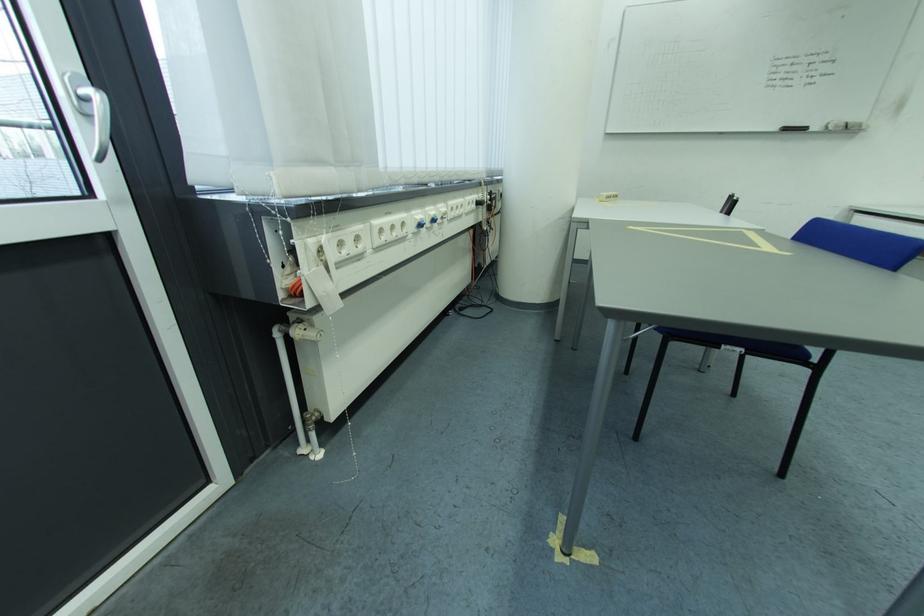
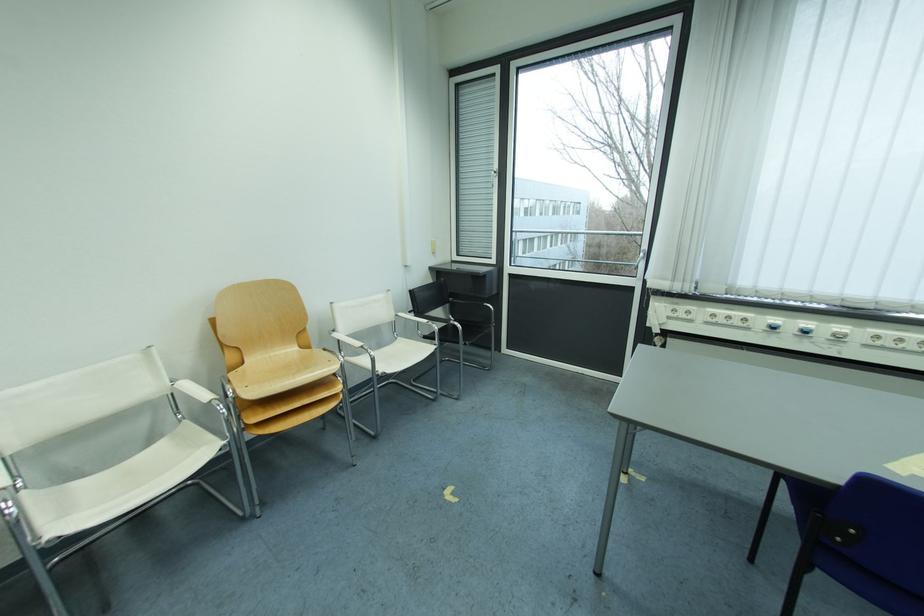
In the second image, find the point that corresponds to (458,223) in the first image.

(874, 347)